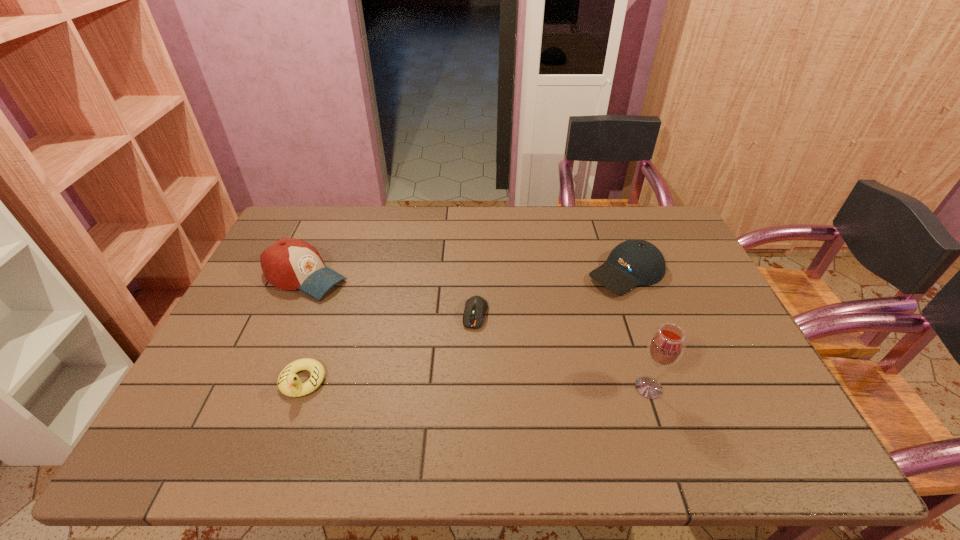
You are a GUI agent. You are given a task and a screenshot of the screen. Output one action in this format:
    pyautogui.click(x=<x>, y=<y>)
    Task: Click on the vacant space on the desktop that is between the duckling and the tallest object and is positioned on the front-facing side of the third tallest object
    This screenshot has width=960, height=540.
    Given the screenshot: What is the action you would take?
    pyautogui.click(x=452, y=384)

Image resolution: width=960 pixels, height=540 pixels. Find the location of `vacant space on the desktop that is between the duckling and the wineglass and is positioned on the button of the third object from left to right`. vacant space on the desktop that is between the duckling and the wineglass and is positioned on the button of the third object from left to right is located at coordinates (461, 384).

Where is `vacant space on the desktop that is between the duckling and the tallest object and is positioned on the front-facing side of the second tallest object`? vacant space on the desktop that is between the duckling and the tallest object and is positioned on the front-facing side of the second tallest object is located at coordinates (525, 386).